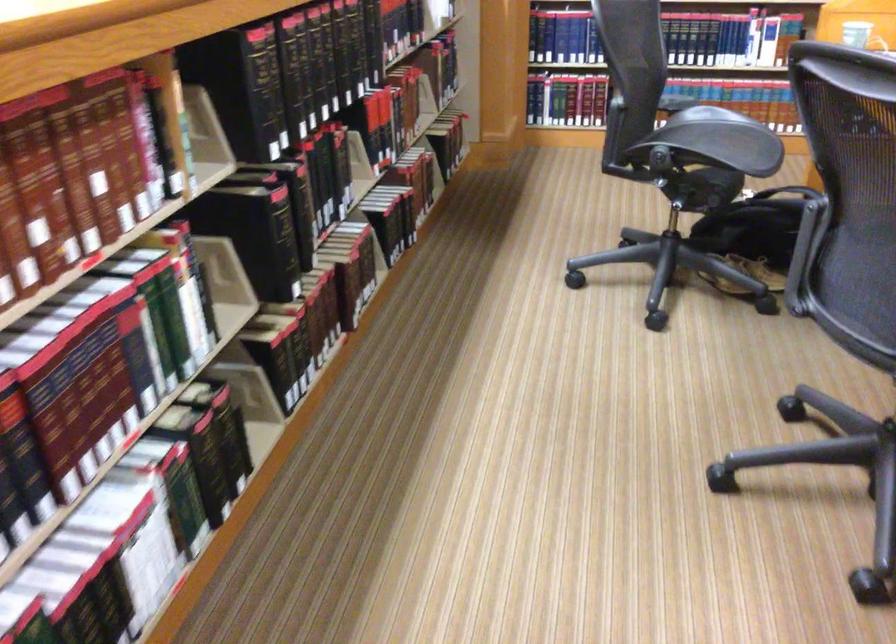
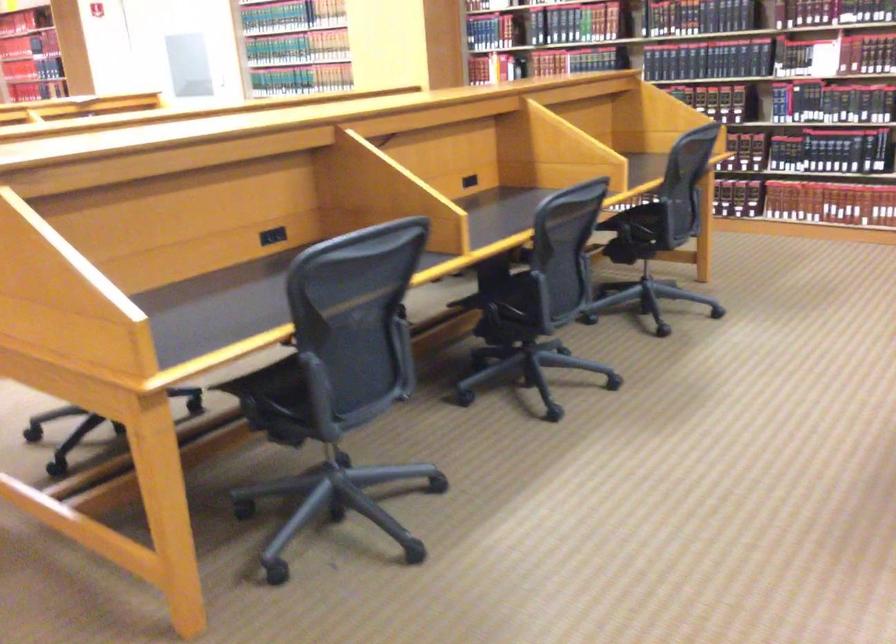
What movement of the cameraman would produce the second image?

The cameraman moved toward right, backward.